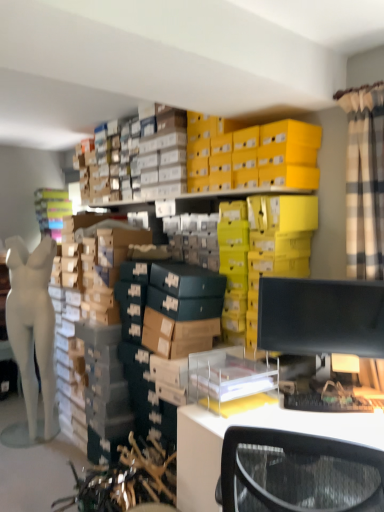
Question: From the image's perspective, is black matte monitor at right above or below white plastic desk at lower right?

Choices:
 (A) below
 (B) above

Answer: (B)

Question: Considering their positions, is black matte monitor at right located in front of or behind white plastic desk at lower right?

Choices:
 (A) behind
 (B) front

Answer: (A)

Question: Based on their relative distances, which object is nearer to the white matte mannequin at left?

Choices:
 (A) white plastic desk at lower right
 (B) black matte monitor at right

Answer: (A)

Question: Which of these objects is positioned closest to the white matte mannequin at left?

Choices:
 (A) black matte monitor at right
 (B) white plastic desk at lower right

Answer: (B)